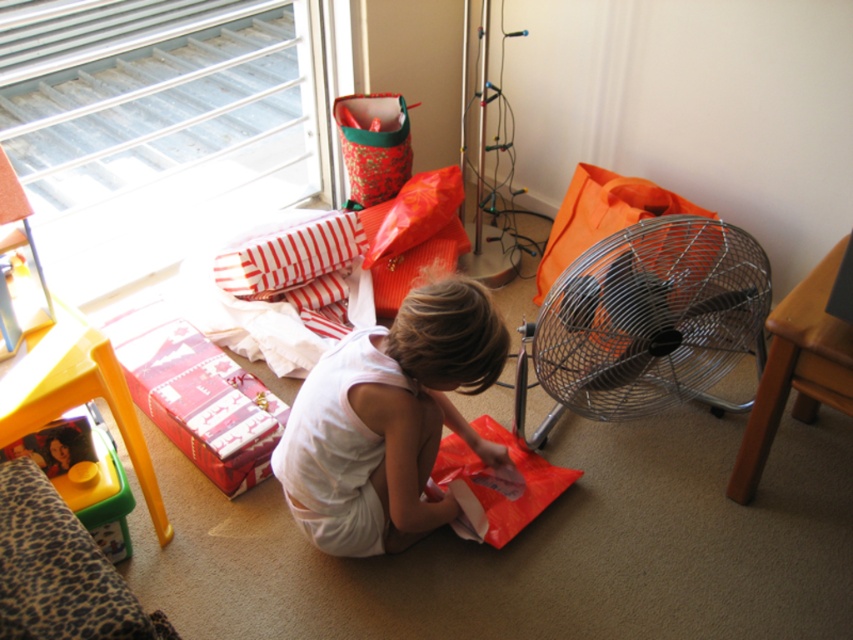
You are a parent trying to decide where to place a new decorative item in the living room. The item is 1.2 meters wide. There is space between the white fabric child at center and the metallic silver fan at right. Do you think the item will fit in that space?

The white fabric child at center is bigger than the metallic silver fan at right, but the exact distance between them isn

You are a parent trying to locate your child in the living room. The child is wearing a white fabric dress and is near a metallic silver fan. Based on the scene description, where would you find the white fabric child at center relative to the metallic silver fan at right?

The white fabric child at center is to the left of the metallic silver fan at right.